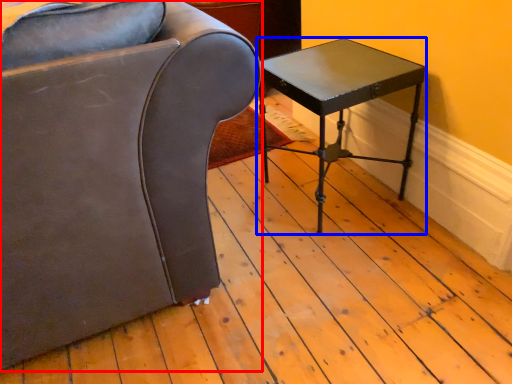
Question: Among these objects, which one is farthest to the camera, chair (highlighted by a red box) or table (highlighted by a blue box)?

Choices:
 (A) chair
 (B) table

Answer: (B)